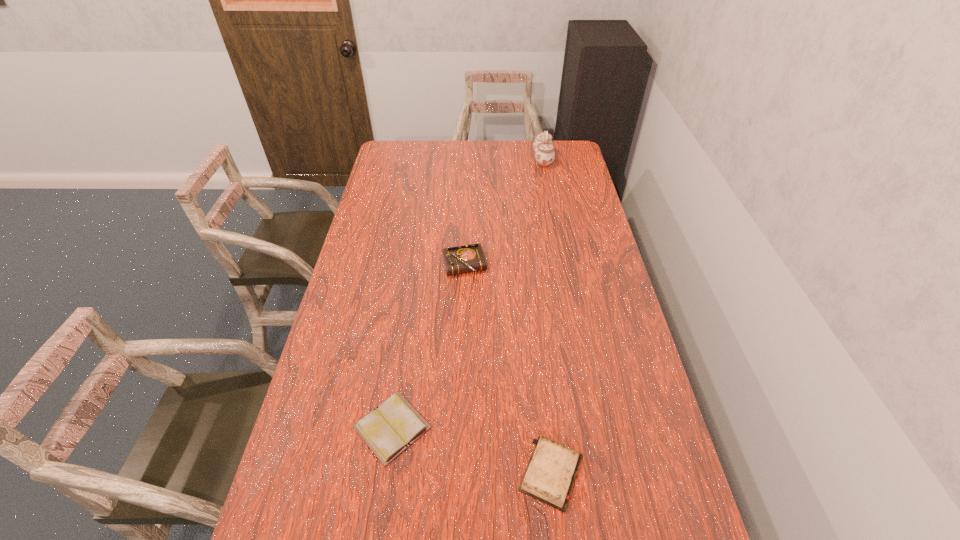
This screenshot has height=540, width=960. Identify the location of free space between the third shortest object and the shortest diary. (428, 347).

Identify the location of free area in between the tallest diary and the shortest diary. Image resolution: width=960 pixels, height=540 pixels. (428, 347).

This screenshot has height=540, width=960. In order to click on object identified as the closest to the shortest diary in this screenshot , I will do `click(549, 477)`.

Select which object appears as the third closest to the second shortest object. Please provide its 2D coordinates. Your answer should be formatted as a tuple, i.e. [(x, y)], where the tuple contains the x and y coordinates of a point satisfying the conditions above.

[(543, 146)]

Choose which diary is the second nearest neighbor to the tallest object. Please provide its 2D coordinates. Your answer should be formatted as a tuple, i.e. [(x, y)], where the tuple contains the x and y coordinates of a point satisfying the conditions above.

[(394, 425)]

I want to click on diary identified as the second closest to the shortest diary, so click(469, 258).

This screenshot has width=960, height=540. Find the location of `free space that satisfies the following two spatial constraints: 1. by the handle of the farthest object; 2. on the front side of the farthest diary`. free space that satisfies the following two spatial constraints: 1. by the handle of the farthest object; 2. on the front side of the farthest diary is located at coordinates (564, 266).

The height and width of the screenshot is (540, 960). Identify the location of free spot that satisfies the following two spatial constraints: 1. on the back side of the shortest diary; 2. on the right side of the second tallest object. click(416, 266).

You are a GUI agent. You are given a task and a screenshot of the screen. Output one action in this format:
    pyautogui.click(x=<x>, y=<y>)
    Task: Click on the vacant space that satisfies the following two spatial constraints: 1. by the handle of the chinaware; 2. on the front side of the second shortest object
    
    Given the screenshot: What is the action you would take?
    pyautogui.click(x=604, y=473)